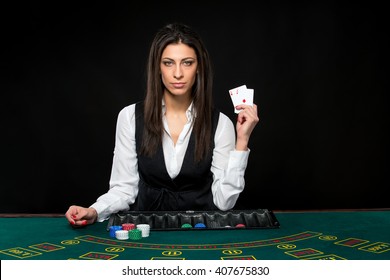
The width and height of the screenshot is (390, 280). Identify the location of black tray. (251, 218).